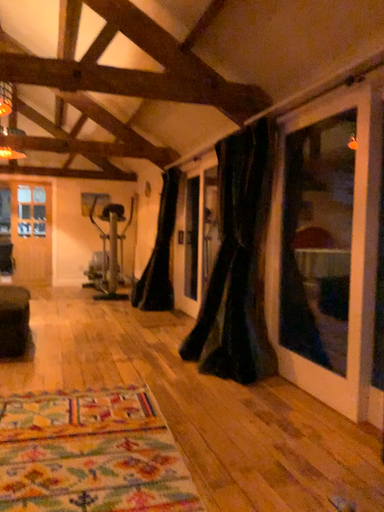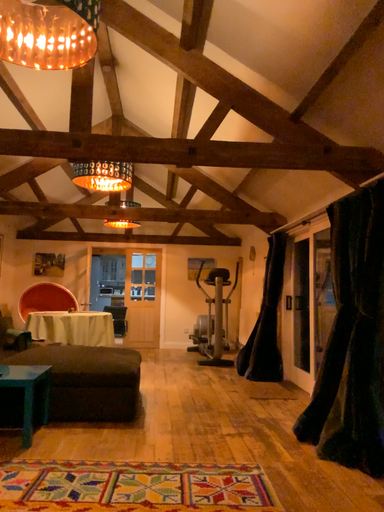
Question: Which way did the camera rotate in the video?

Choices:
 (A) rotated downward
 (B) rotated upward

Answer: (B)